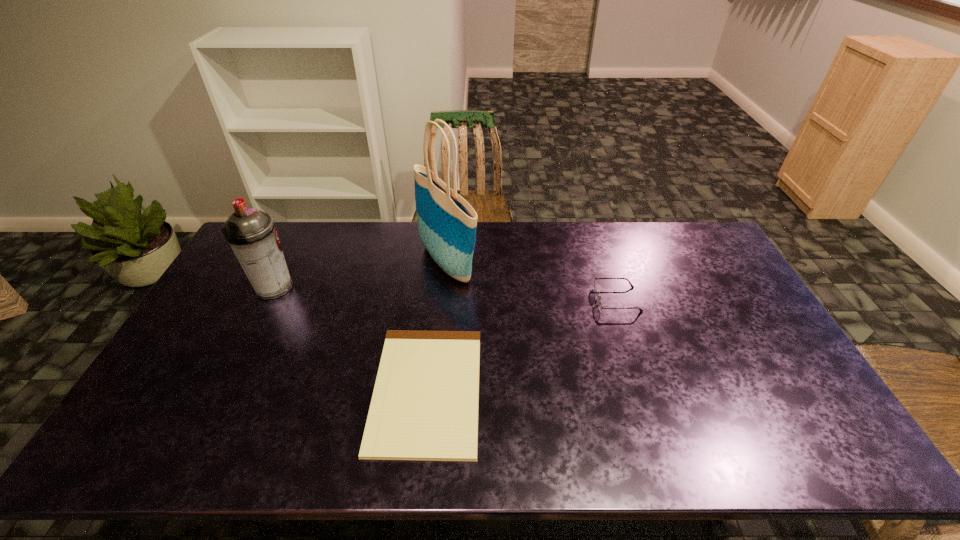
Identify which object is the nearest to the spectacles. Please provide its 2D coordinates. Your answer should be formatted as a tuple, i.e. [(x, y)], where the tuple contains the x and y coordinates of a point satisfying the conditions above.

[(424, 407)]

Locate which object ranks in proximity to the third tallest object. Please provide its 2D coordinates. Your answer should be formatted as a tuple, i.e. [(x, y)], where the tuple contains the x and y coordinates of a point satisfying the conditions above.

[(424, 407)]

This screenshot has width=960, height=540. In order to click on vacant point that satisfies the following two spatial constraints: 1. on the back side of the tote bag; 2. on the left side of the clipboard in this screenshot , I will do `click(440, 263)`.

This screenshot has height=540, width=960. Identify the location of vacant region that satisfies the following two spatial constraints: 1. on the front-facing side of the third tallest object; 2. on the front side of the nearest object. (646, 389).